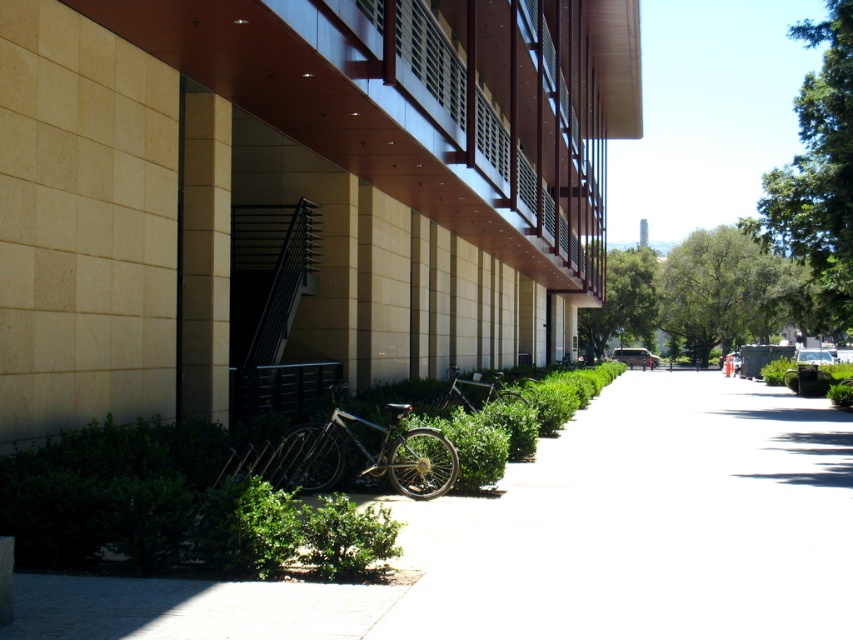
Question: Can you confirm if white concrete pavement at lower center is positioned to the left of silver metallic bicycle at center?

Choices:
 (A) no
 (B) yes

Answer: (A)

Question: Is white concrete pavement at lower center positioned behind silver metallic bicycle at center?

Choices:
 (A) yes
 (B) no

Answer: (B)

Question: Considering the relative positions of white concrete pavement at lower center and silver metallic bicycle at center in the image provided, where is white concrete pavement at lower center located with respect to silver metallic bicycle at center?

Choices:
 (A) right
 (B) left

Answer: (A)

Question: Which object is the closest to the silver metallic bicycle at center?

Choices:
 (A) shiny metallic bicycle at center
 (B) white concrete pavement at lower center

Answer: (B)

Question: Which of these objects is positioned farthest from the shiny metallic bicycle at center?

Choices:
 (A) silver metallic bicycle at center
 (B) white concrete pavement at lower center

Answer: (A)

Question: Which point appears farthest from the camera in this image?

Choices:
 (A) (714, 620)
 (B) (465, 381)
 (C) (325, 452)

Answer: (B)